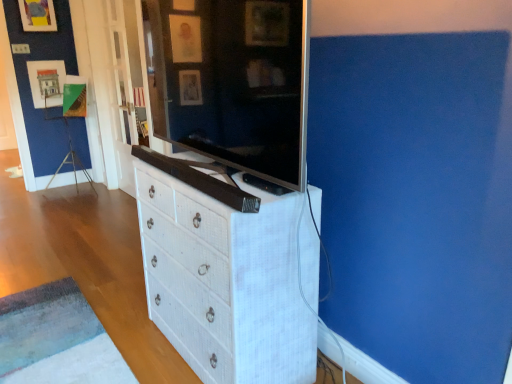
Question: From a real-world perspective, is matte black television at center positioned under white textured chest of drawers at center based on gravity?

Choices:
 (A) no
 (B) yes

Answer: (A)

Question: From the image's perspective, is matte black television at center under white textured chest of drawers at center?

Choices:
 (A) yes
 (B) no

Answer: (B)

Question: Does matte black television at center have a lesser height compared to white textured chest of drawers at center?

Choices:
 (A) no
 (B) yes

Answer: (B)

Question: Is matte black television at center positioned behind white textured chest of drawers at center?

Choices:
 (A) yes
 (B) no

Answer: (B)

Question: Considering the relative sizes of matte black television at center and white textured chest of drawers at center in the image provided, is matte black television at center thinner than white textured chest of drawers at center?

Choices:
 (A) no
 (B) yes

Answer: (B)

Question: Does matte black television at center have a greater height compared to white textured chest of drawers at center?

Choices:
 (A) no
 (B) yes

Answer: (A)

Question: Are white textured chest of drawers at center and matte black television at center far apart?

Choices:
 (A) no
 (B) yes

Answer: (A)

Question: From the image's perspective, would you say white textured chest of drawers at center is positioned over matte black television at center?

Choices:
 (A) yes
 (B) no

Answer: (B)

Question: Is white textured chest of drawers at center shorter than matte black television at center?

Choices:
 (A) no
 (B) yes

Answer: (A)

Question: Can you confirm if white textured chest of drawers at center is wider than matte black television at center?

Choices:
 (A) no
 (B) yes

Answer: (B)

Question: Considering the relative positions of white textured chest of drawers at center and matte black television at center in the image provided, is white textured chest of drawers at center to the left of matte black television at center from the viewer's perspective?

Choices:
 (A) yes
 (B) no

Answer: (B)

Question: Does white textured chest of drawers at center come behind matte black television at center?

Choices:
 (A) yes
 (B) no

Answer: (A)

Question: Considering their positions, is matte black television at center located in front of or behind white textured chest of drawers at center?

Choices:
 (A) front
 (B) behind

Answer: (A)